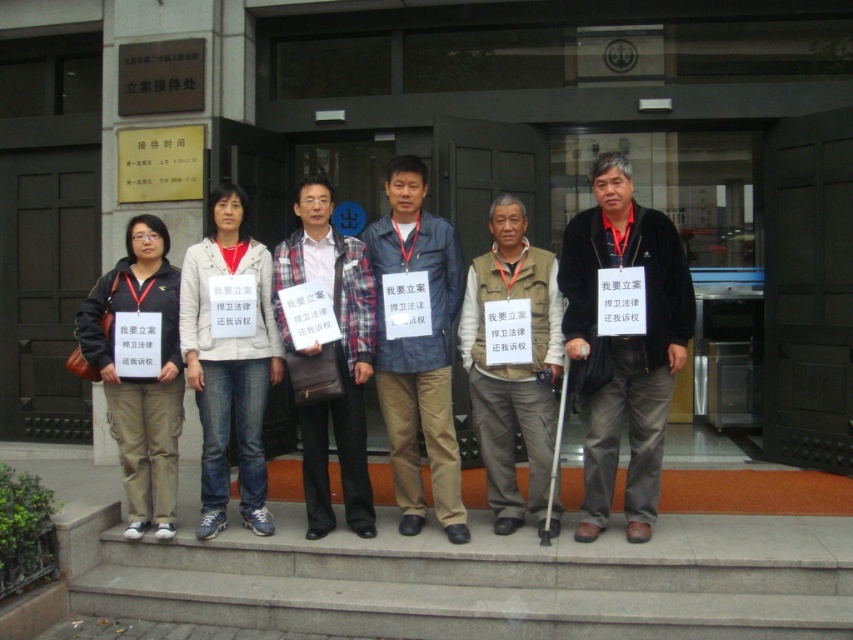
Between denim jeans at center and matte black jacket at left, which one appears on the left side from the viewer's perspective?

matte black jacket at left is more to the left.

Which is below, denim jeans at center or matte black jacket at left?

matte black jacket at left is lower down.

Who is more distant from viewer, (x=207, y=404) or (x=135, y=257)?

Positioned behind is point (x=135, y=257).

Identify the location of denim jeans at center. This screenshot has width=853, height=640. (229, 364).

From the picture: Does dark gray pants at center have a lesser height compared to brown vest at center?

Incorrect, dark gray pants at center's height does not fall short of brown vest at center's.

Find the location of a particular element. Image resolution: width=853 pixels, height=640 pixels. dark gray pants at center is located at coordinates pyautogui.click(x=625, y=346).

Image resolution: width=853 pixels, height=640 pixels. Describe the element at coordinates (625, 346) in the screenshot. I see `dark gray pants at center` at that location.

Where is `dark gray pants at center`? This screenshot has height=640, width=853. dark gray pants at center is located at coordinates (625, 346).

Does brown vest at center have a greater width compared to matte black jacket at left?

No, brown vest at center is not wider than matte black jacket at left.

At what (x,y) coordinates should I click in order to perform the action: click on brown vest at center. Please return your answer as a coordinate pair (x, y). Looking at the image, I should click on (514, 364).

You are a GUI agent. You are given a task and a screenshot of the screen. Output one action in this format:
    pyautogui.click(x=<x>, y=<y>)
    Task: Click on the brown vest at center
    Image resolution: width=853 pixels, height=640 pixels.
    Given the screenshot: What is the action you would take?
    pyautogui.click(x=514, y=364)